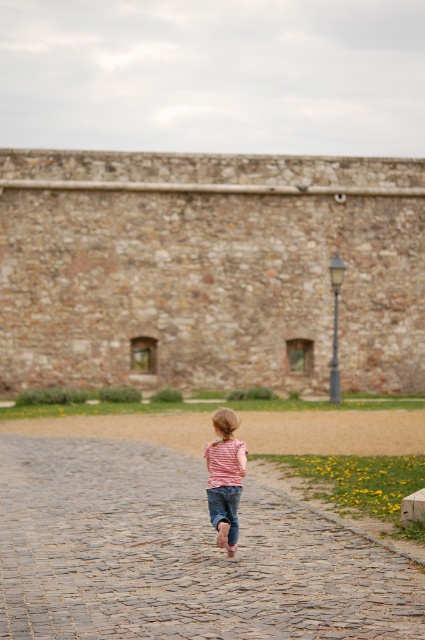
You are a photographer trying to capture the striped fabric shirt at center and the stone wall at upper center in a single shot. Based on their positions, which object should you adjust your camera to focus on first to ensure both are in frame?

Since the stone wall at upper center is to the left of the striped fabric shirt at center, you should focus on the stone wall at upper center first to ensure both objects are included in the frame.